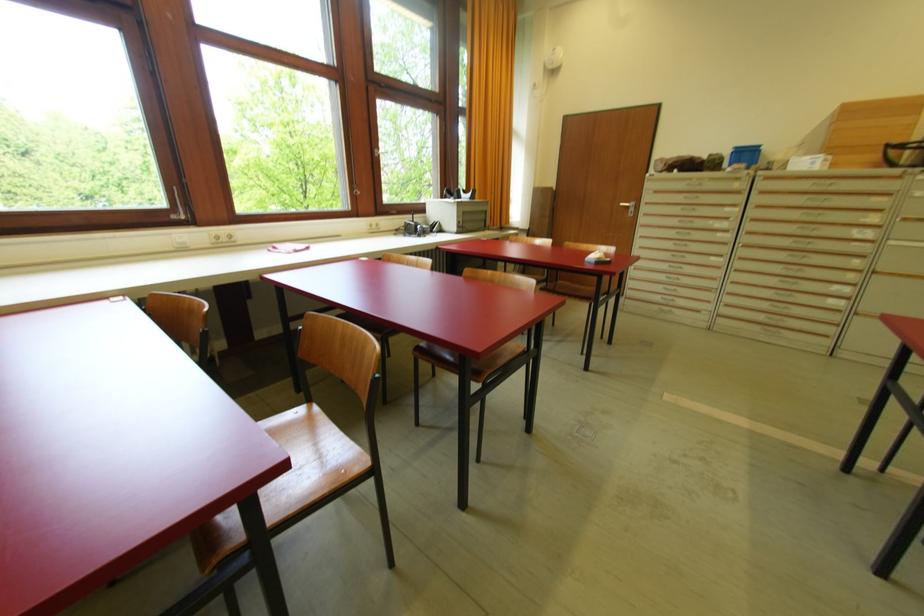
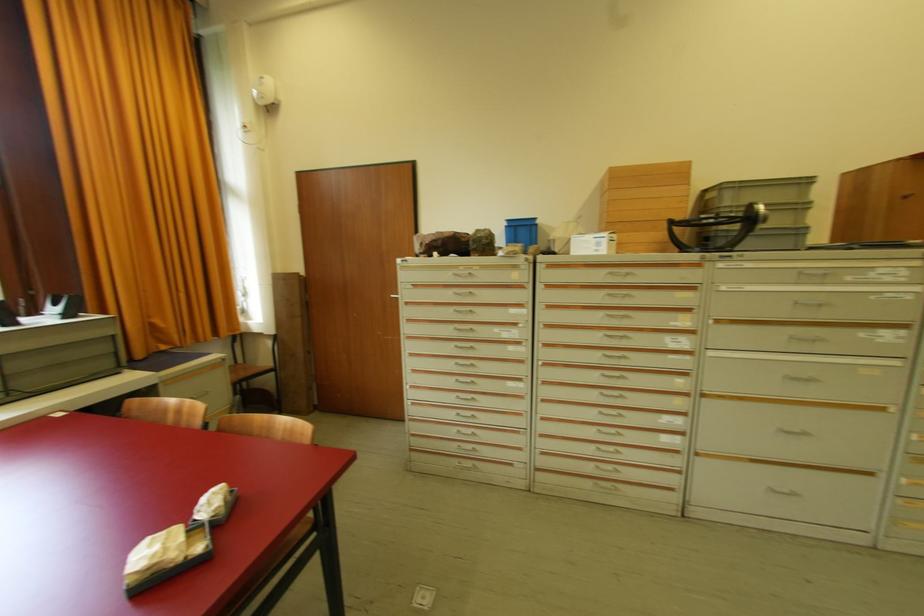
Locate, in the second image, the point that corresponds to pixel 697 180 in the first image.

(464, 270)